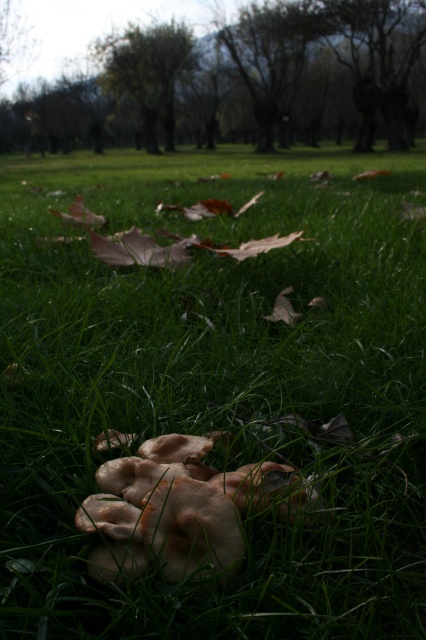
You are standing at the origin point of the coordinate system. You want to walk to the light brown soft fungi at center. What are the coordinates you need to reach?

The coordinates to reach the light brown soft fungi at center are at point (181, 509).

You are a hiker who wants to take a photo of the light brown soft fungi at center without the brown textured tree at center blocking the view. Can you move to a position where the fungi are visible without the tree in the frame?

The brown textured tree at center is located above the light brown soft fungi at center, so if you move to a lower position or angle your camera downward, you can capture the fungi without the tree obstructing the view.